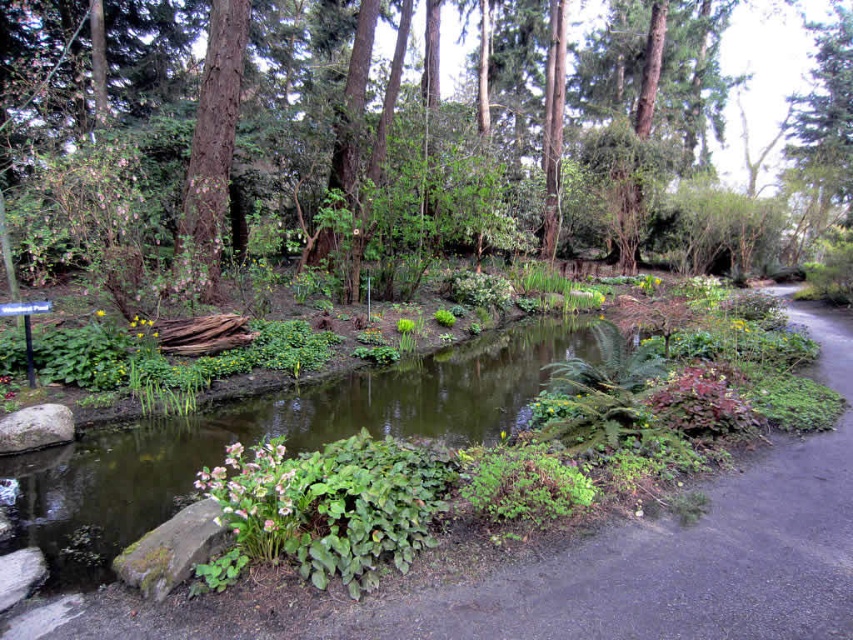
The height and width of the screenshot is (640, 853). Describe the element at coordinates (270, 436) in the screenshot. I see `green leafy stream at center` at that location.

Between green leafy stream at center and white matte flower at center, which one has less height?

white matte flower at center is shorter.

Is point (71, 488) farther from viewer compared to point (260, 529)?

Yes, point (71, 488) is farther from viewer.

This screenshot has width=853, height=640. In order to click on green leafy stream at center in this screenshot , I will do 270,436.

Is green leafy stream at center below green rough bark tree at upper left?

Correct, green leafy stream at center is located below green rough bark tree at upper left.

Who is more forward, (x=426, y=400) or (x=238, y=100)?

Point (x=426, y=400) is in front.

Who is more forward, (497, 404) or (225, 96)?

Point (497, 404)

This screenshot has height=640, width=853. I want to click on green leafy stream at center, so click(270, 436).

Which is more to the right, white matte flower at center or yellow matte flower at center?

white matte flower at center

Is white matte flower at center positioned before yellow matte flower at center?

Yes, it is.

Describe the element at coordinates (253, 490) in the screenshot. I see `white matte flower at center` at that location.

The height and width of the screenshot is (640, 853). Identify the location of white matte flower at center. (253, 490).